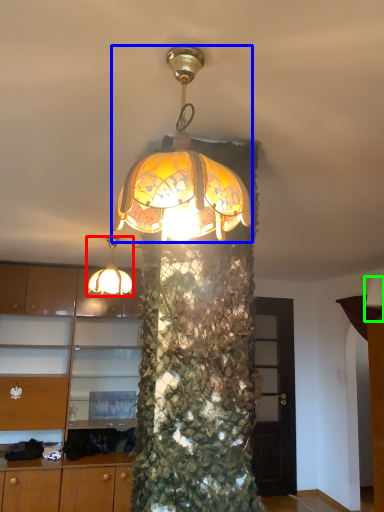
Question: Considering the real-world distances, which object is closest to lamp (highlighted by a red box)? lamp (highlighted by a blue box) or lamp (highlighted by a green box).

Choices:
 (A) lamp
 (B) lamp

Answer: (A)